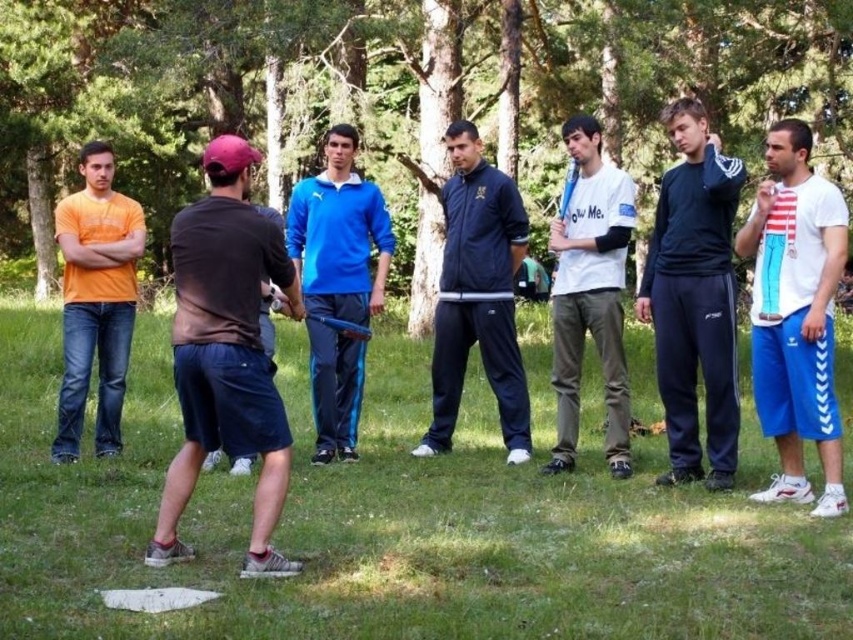
Question: From the image, what is the correct spatial relationship of dark brown cotton t-shirt at center in relation to orange t-shirt at left?

Choices:
 (A) left
 (B) right

Answer: (B)

Question: Which of the following is the closest to the observer?

Choices:
 (A) (74, 253)
 (B) (665, 424)
 (C) (181, 276)
 (D) (349, 236)

Answer: (C)

Question: Can you confirm if dark blue track pants at center is positioned below orange t-shirt at left?

Choices:
 (A) no
 (B) yes

Answer: (A)

Question: Is green grass at center above white cotton t-shirt at right?

Choices:
 (A) no
 (B) yes

Answer: (A)

Question: Which point appears closest to the camera in this image?

Choices:
 (A) (213, 406)
 (B) (706, 248)
 (C) (595, 346)

Answer: (A)

Question: Which object is farther from the camera taking this photo?

Choices:
 (A) dark brown cotton t-shirt at center
 (B) orange t-shirt at left

Answer: (B)